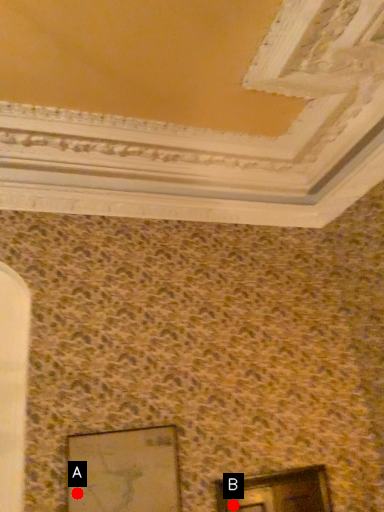
Question: Two points are circled on the image, labeled by A and B beside each circle. Which point is farther from the camera taking this photo?

Choices:
 (A) A is further
 (B) B is further

Answer: (B)